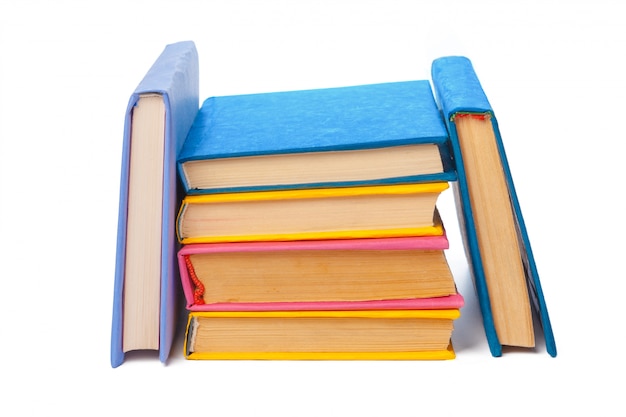
Where is `books`? This screenshot has width=626, height=417. books is located at coordinates (473, 108), (372, 123), (155, 116), (257, 218), (290, 273), (316, 329).